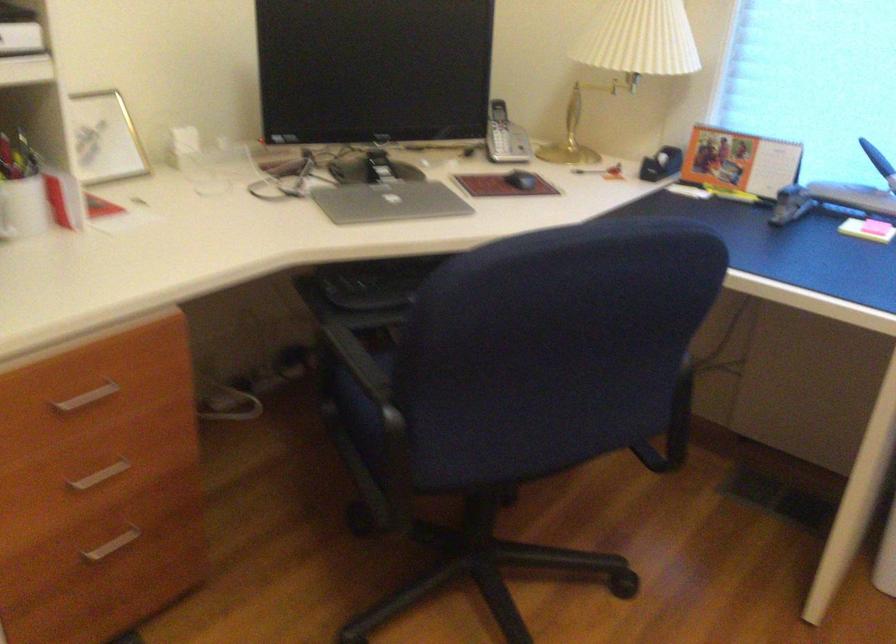
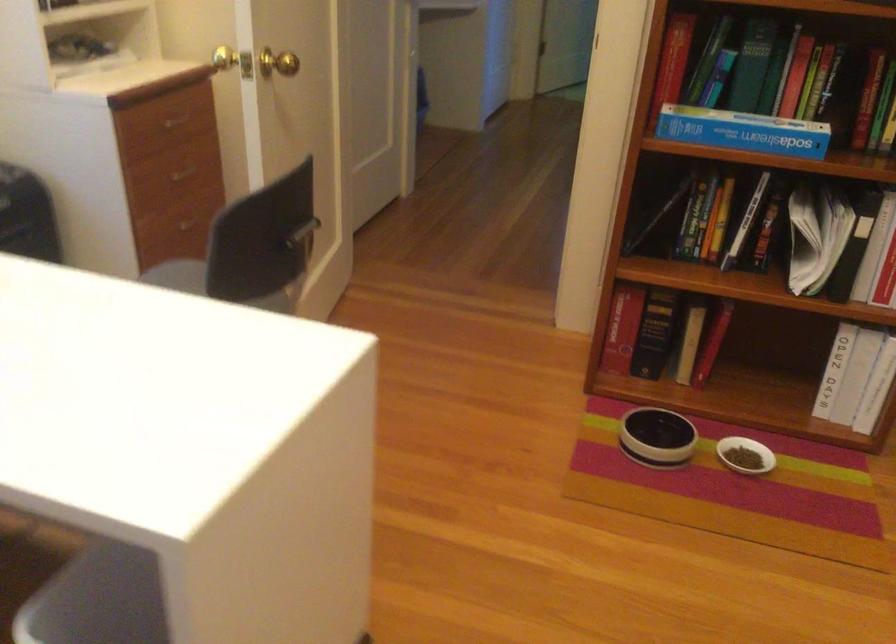
First-person continuous shooting, in which direction is the camera rotating?

The rotation direction of the camera is right-down.